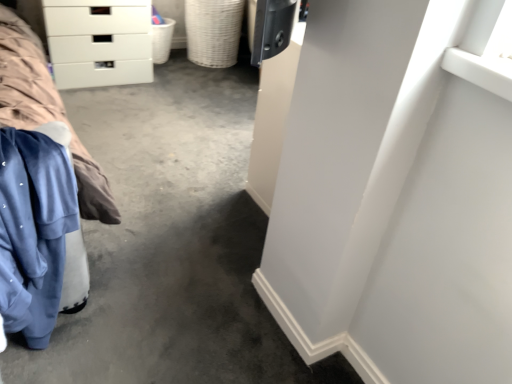
The image size is (512, 384). I want to click on vacant area that lies between blue fleece at left and woven beige basket at center, which is counted as the first basket, starting from the right, so click(x=166, y=143).